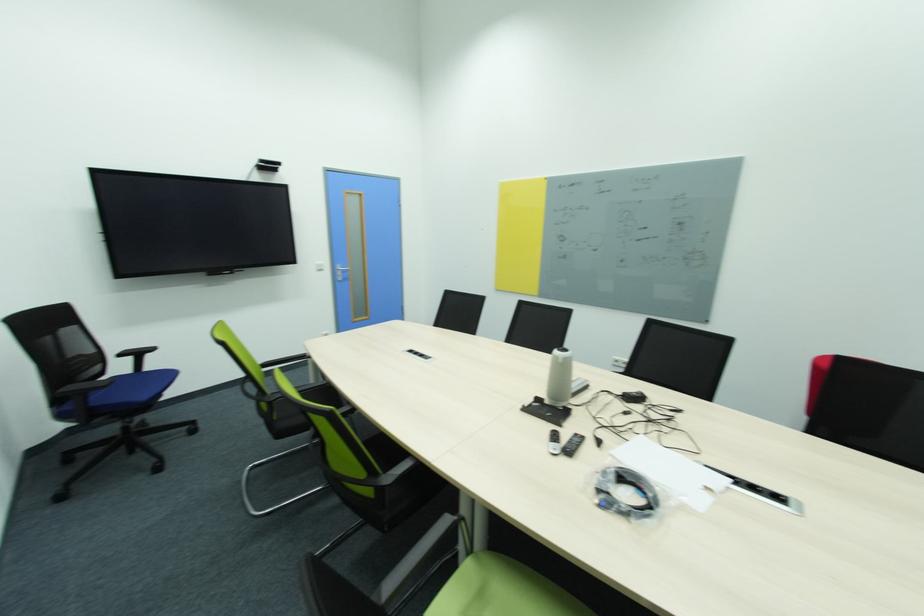
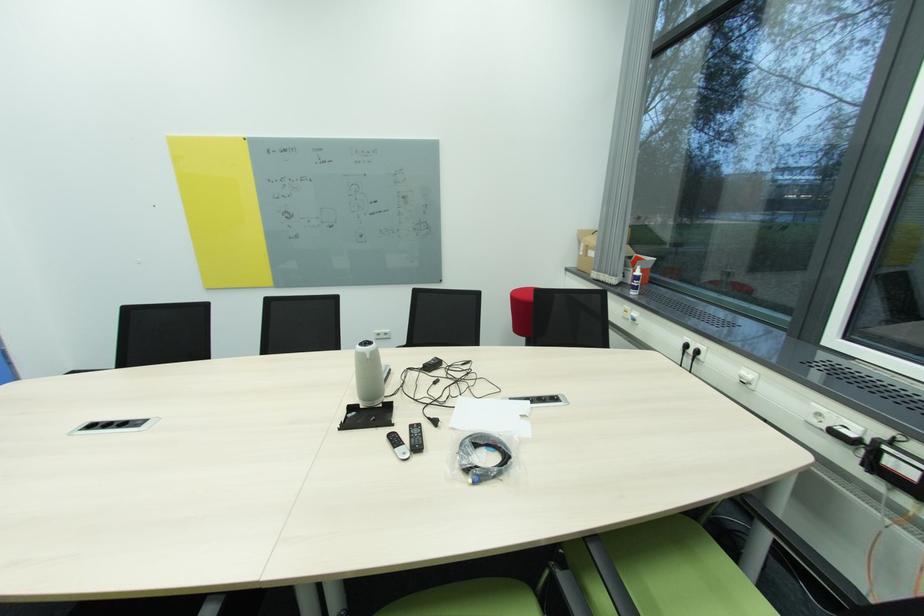
In the second image, find the point that corresponds to [580,436] in the first image.

(416, 427)